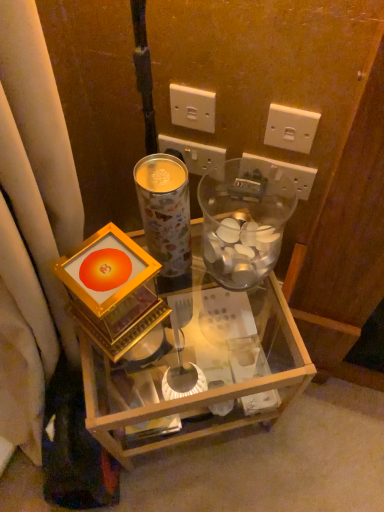
Question: In the image, is black plastic power outlet at upper right, positioned as the second power outlet in right-to-left order, positioned in front of or behind metallic floral-patterned coffee cup at center?

Choices:
 (A) behind
 (B) front

Answer: (A)

Question: Is black plastic power outlet at upper right, positioned as the second power outlet in right-to-left order, bigger or smaller than metallic floral-patterned coffee cup at center?

Choices:
 (A) small
 (B) big

Answer: (A)

Question: Which is farther from the white plastic power outlet at upper center, placed as the 1th power outlet when sorted from left to right?

Choices:
 (A) black plastic power outlet at upper right, the third power outlet from the left
 (B) white plastic power outlet at upper right, acting as the 1th power outlet starting from the right
 (C) transparent glass jar at center-right
 (D) metallic floral-patterned coffee cup at center
 (E) white plastic power outlet at upper center, acting as the second power outlet starting from the left

Answer: (D)

Question: Which object is positioned farthest from the gold metallic frame at center?

Choices:
 (A) black plastic power outlet at upper right, positioned as the second power outlet in right-to-left order
 (B) transparent glass jar at center-right
 (C) white plastic power outlet at upper right, the fourth power outlet from the left
 (D) metallic floral-patterned coffee cup at center
 (E) white plastic power outlet at upper center, which is counted as the fourth power outlet, starting from the right

Answer: (E)